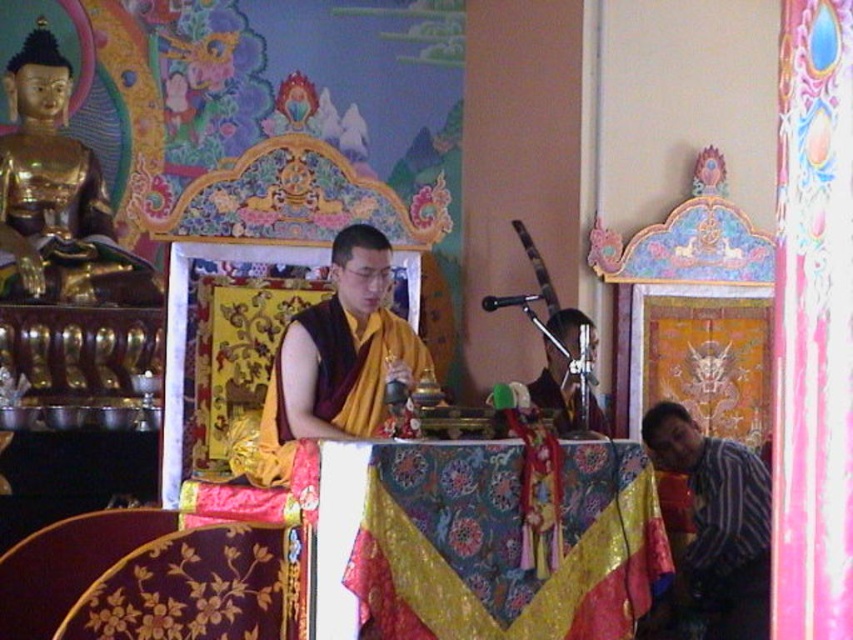
Question: Can you confirm if yellow silk monk at center is wider than striped cotton shirt at lower right?

Choices:
 (A) no
 (B) yes

Answer: (B)

Question: Based on their relative distances, which object is nearer to the yellow silk monk at center?

Choices:
 (A) gold polished statue at upper left
 (B) silky yellow robe at center
 (C) striped cotton shirt at lower right

Answer: (B)

Question: Which of the following is the closest to the observer?

Choices:
 (A) (543, 392)
 (B) (711, 557)
 (C) (22, 99)
 (D) (274, 355)

Answer: (B)

Question: Can you confirm if gold polished statue at upper left is positioned to the right of striped cotton shirt at lower right?

Choices:
 (A) yes
 (B) no

Answer: (B)

Question: Which object is farther from the camera taking this photo?

Choices:
 (A) silky yellow robe at center
 (B) yellow silk monk at center
 (C) striped cotton shirt at lower right

Answer: (C)

Question: Is yellow silk monk at center above striped cotton shirt at lower right?

Choices:
 (A) no
 (B) yes

Answer: (B)